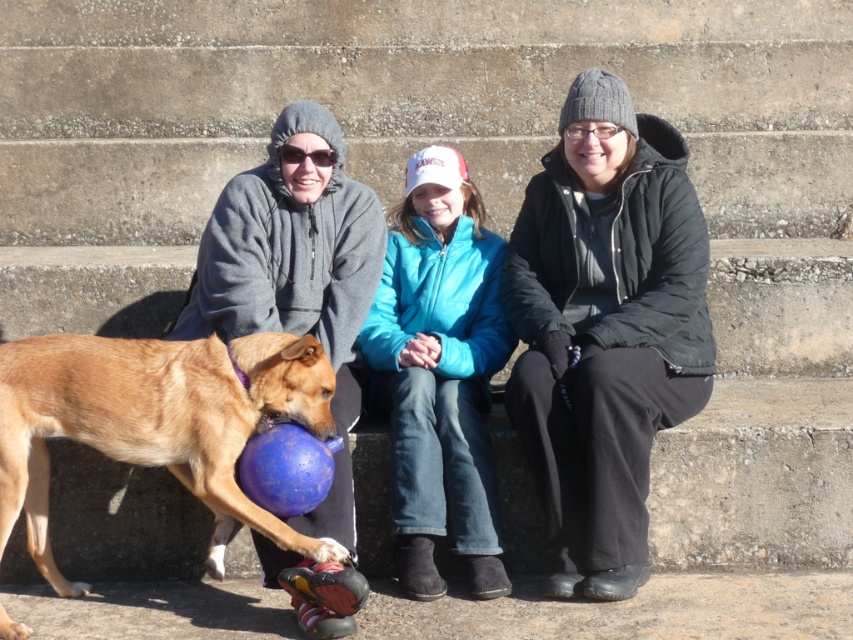
You are a photographer trying to capture a photo of the black fuzzy jacket at center and the brown fur dog at center. Which one is positioned higher in the image?

The black fuzzy jacket at center is above the brown fur dog at center, so it is positioned higher in the image.

You are a photographer trying to capture a group photo of the gray fleece jacket at left and the brown fur dog at center. Which subject should you focus on first if you want to ensure both are in focus, considering their sizes?

The gray fleece jacket at left is larger than the brown fur dog at center, so focusing on the larger subject first would help ensure both are in focus.